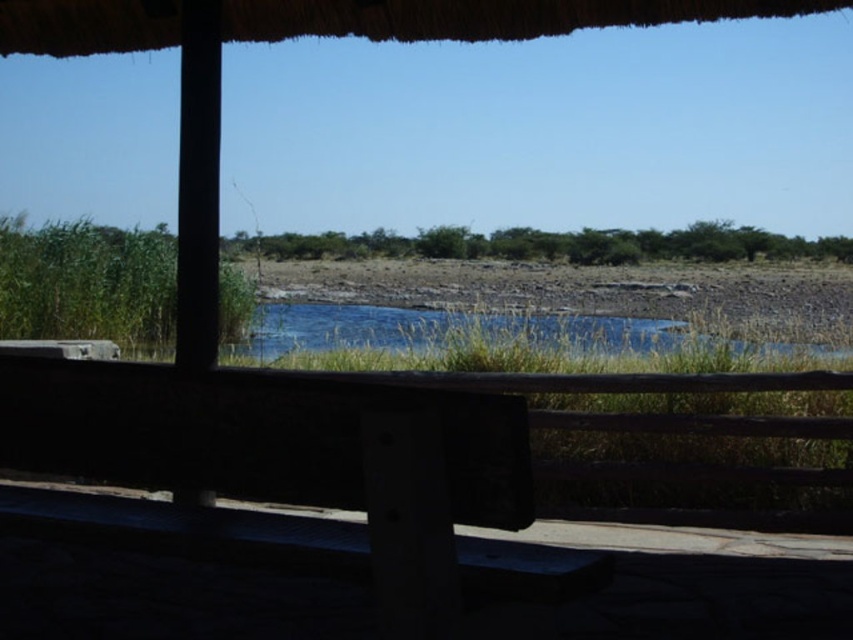
Question: Can you confirm if wooden bench at center is bigger than blue grassy river at center?

Choices:
 (A) no
 (B) yes

Answer: (A)

Question: Which of the following is the closest to the observer?

Choices:
 (A) (601, 321)
 (B) (270, 387)

Answer: (B)

Question: Is wooden bench at center below blue grassy river at center?

Choices:
 (A) yes
 (B) no

Answer: (B)

Question: Does wooden bench at center come behind blue grassy river at center?

Choices:
 (A) yes
 (B) no

Answer: (B)